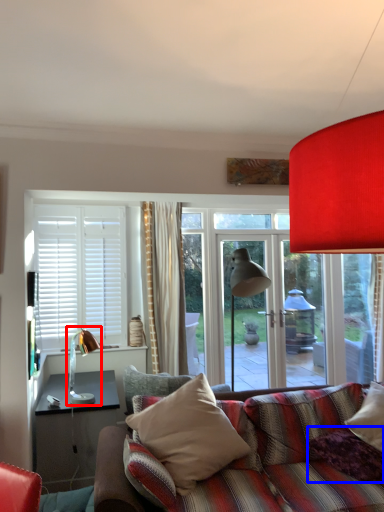
Question: Among these objects, which one is nearest to the camera, table lamp (highlighted by a red box) or pillow (highlighted by a blue box)?

Choices:
 (A) table lamp
 (B) pillow

Answer: (B)